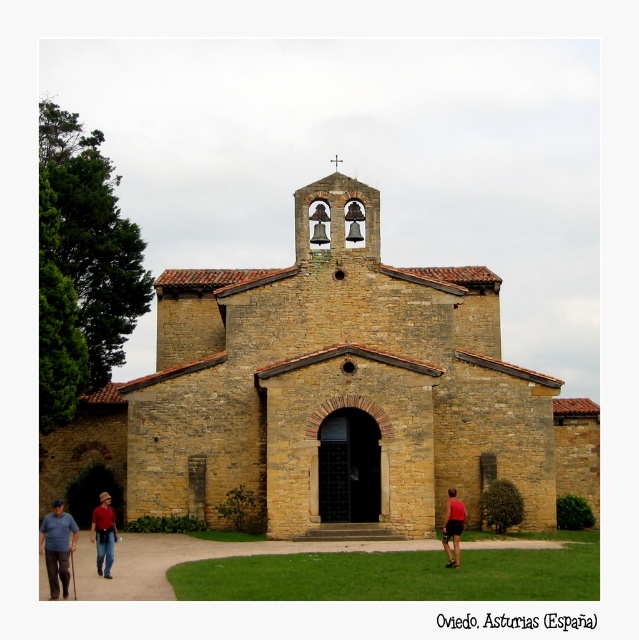
You are standing in front of the historic stone church in Oviedo, Asturias, Spain. You notice two people wearing a blue shirt at lower left and a red shirt at lower left. Which shirt is bigger in size?

The blue shirt at lower left is larger in size compared to the red shirt at lower left.

You are a tourist visiting the historic stone church in Oviedo, Asturias, Spain. You notice the yellow stone chapel at center and the blue shirt at lower left. Which object is wider?

The yellow stone chapel at center is wider than the blue shirt at lower left.

You are standing in front of the historic stone church in Oviedo, Asturias, Spain. You see two people wearing a blue shirt at lower left and a red shirt at lower left. Which shirt is closer to the ground?

The blue shirt at lower left is positioned under the red shirt at lower left, so the blue shirt at lower left is closer to the ground.